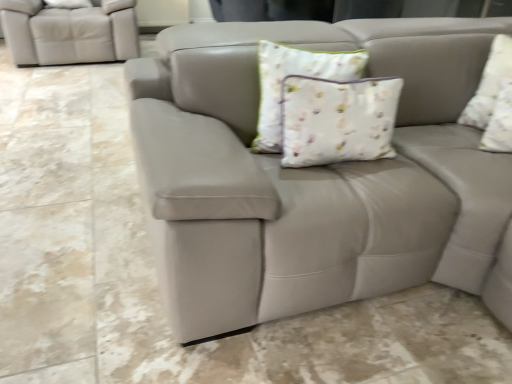
Question: Can you confirm if white floral fabric pillow at center, which is the 1th pillow from left to right, is positioned to the right of matte leather couch at center?

Choices:
 (A) yes
 (B) no

Answer: (A)

Question: Is white floral fabric pillow at center, the second pillow viewed from the right, positioned in front of matte leather couch at center?

Choices:
 (A) yes
 (B) no

Answer: (B)

Question: Could matte leather couch at center be considered to be inside white floral fabric pillow at center, which is the 1th pillow from left to right?

Choices:
 (A) yes
 (B) no

Answer: (B)

Question: Can you confirm if white floral fabric pillow at center, which is the 1th pillow from left to right, is smaller than matte leather couch at center?

Choices:
 (A) no
 (B) yes

Answer: (B)

Question: Is white floral fabric pillow at center, which is the 1th pillow from left to right, outside matte leather couch at center?

Choices:
 (A) yes
 (B) no

Answer: (A)

Question: Considering the relative sizes of white floral fabric pillow at center, the second pillow viewed from the right, and matte leather couch at center in the image provided, is white floral fabric pillow at center, the second pillow viewed from the right, bigger than matte leather couch at center?

Choices:
 (A) yes
 (B) no

Answer: (B)

Question: Is matte leather couch at center to the right of white floral fabric pillow at center, which is the 1th pillow from left to right, from the viewer's perspective?

Choices:
 (A) yes
 (B) no

Answer: (B)

Question: Is matte leather couch at center at the left side of white floral fabric pillow at center, which is the 1th pillow from left to right?

Choices:
 (A) yes
 (B) no

Answer: (A)

Question: Can you confirm if matte leather couch at center is shorter than white floral fabric pillow at center, which is the 1th pillow from left to right?

Choices:
 (A) yes
 (B) no

Answer: (A)

Question: Is matte leather couch at center bigger than white floral fabric pillow at center, which is the 1th pillow from left to right?

Choices:
 (A) yes
 (B) no

Answer: (A)

Question: Can you confirm if matte leather couch at center is wider than white floral fabric pillow at center, the second pillow viewed from the right?

Choices:
 (A) yes
 (B) no

Answer: (A)

Question: Is matte leather couch at center positioned with its back to white floral fabric pillow at center, which is the 1th pillow from left to right?

Choices:
 (A) no
 (B) yes

Answer: (A)

Question: Considering the relative sizes of matte leather couch at center and white floral fabric pillow at upper right, arranged as the first pillow when viewed from the right, in the image provided, is matte leather couch at center smaller than white floral fabric pillow at upper right, arranged as the first pillow when viewed from the right,?

Choices:
 (A) no
 (B) yes

Answer: (A)